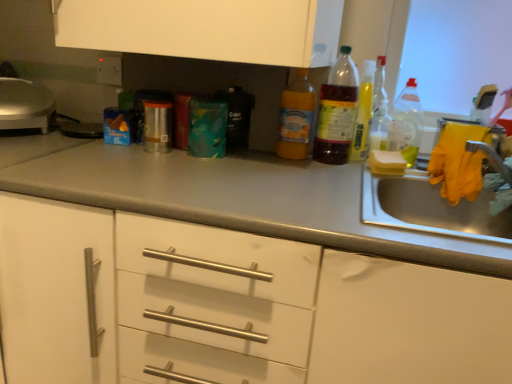
Locate an element on the screen. The width and height of the screenshot is (512, 384). free space in front of translucent plastic bottle at right, the fourth bottle positioned from the left is located at coordinates [383, 167].